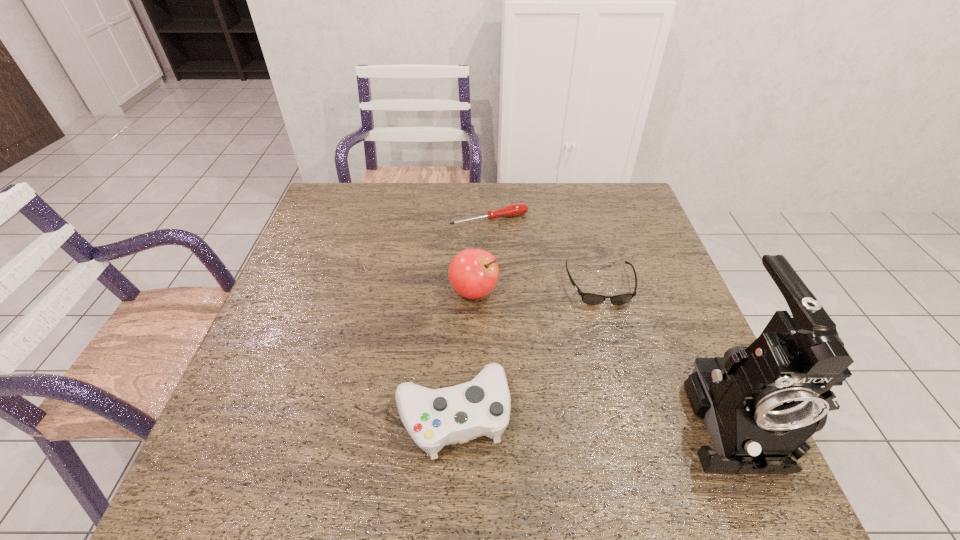
Identify the location of vacant space located 0.180m on the stem of the second tallest object. The width and height of the screenshot is (960, 540). (525, 359).

Find the location of a particular element. Image resolution: width=960 pixels, height=540 pixels. vacant region located on the stem of the second tallest object is located at coordinates (502, 329).

Where is `blank space located on the stem of the second tallest object`? This screenshot has height=540, width=960. blank space located on the stem of the second tallest object is located at coordinates (569, 416).

Where is `free region located 0.210m on the front-facing side of the fourth tallest object`? free region located 0.210m on the front-facing side of the fourth tallest object is located at coordinates (625, 380).

The height and width of the screenshot is (540, 960). I want to click on free space located 0.300m on the front-facing side of the fourth tallest object, so click(x=635, y=418).

Find the location of a particular element. This screenshot has width=960, height=540. free space located on the front-facing side of the fourth tallest object is located at coordinates (614, 340).

Locate an element on the screen. The width and height of the screenshot is (960, 540). object that is at the far edge is located at coordinates (517, 209).

Locate an element on the screen. control at the near edge is located at coordinates (x=434, y=418).

This screenshot has width=960, height=540. In order to click on camcorder located at the near edge in this screenshot , I will do `click(761, 403)`.

At what (x,y) coordinates should I click in order to perform the action: click on camcorder that is at the right edge. Please return your answer as a coordinate pair (x, y). Image resolution: width=960 pixels, height=540 pixels. Looking at the image, I should click on (761, 403).